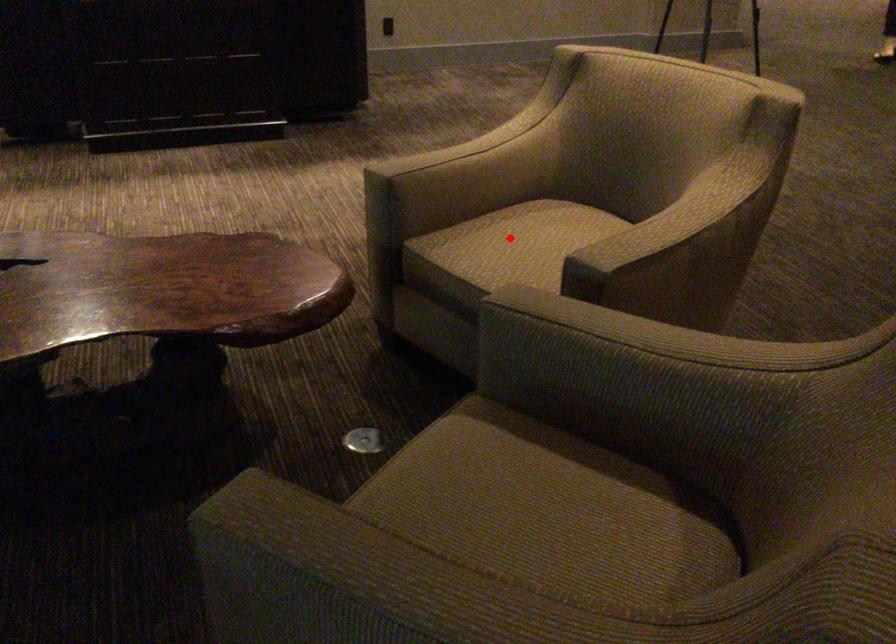
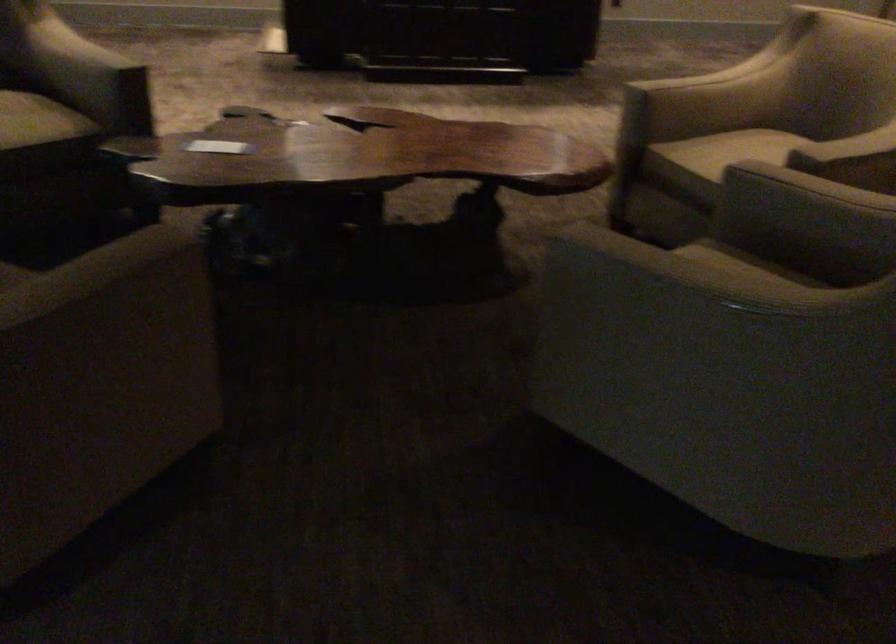
Question: I am providing you with two images of the same scene from different viewpoints. Image1 has a red point marked. In image2, the corresponding 3D location appears at what relative position? Reply with the corresponding letter.

Choices:
 (A) Closer
 (B) Farther

Answer: (B)